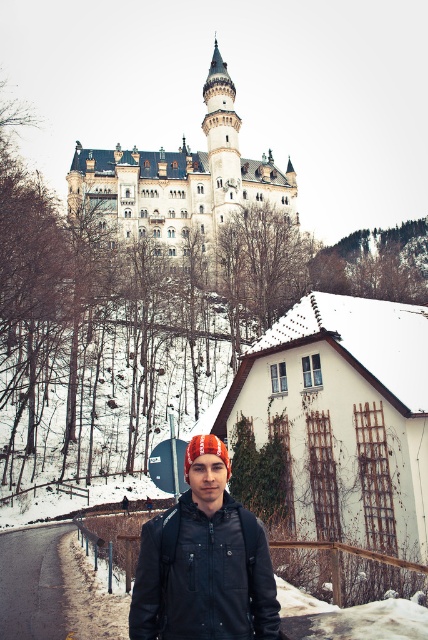
Which is above, white stone castle at upper center or black leather jacket at center?

white stone castle at upper center is above.

This screenshot has height=640, width=428. What do you see at coordinates (199, 195) in the screenshot? I see `white stone castle at upper center` at bounding box center [199, 195].

Which is in front, point (163, 163) or point (226, 515)?

Point (226, 515) is more forward.

This screenshot has width=428, height=640. I want to click on white stone castle at upper center, so click(199, 195).